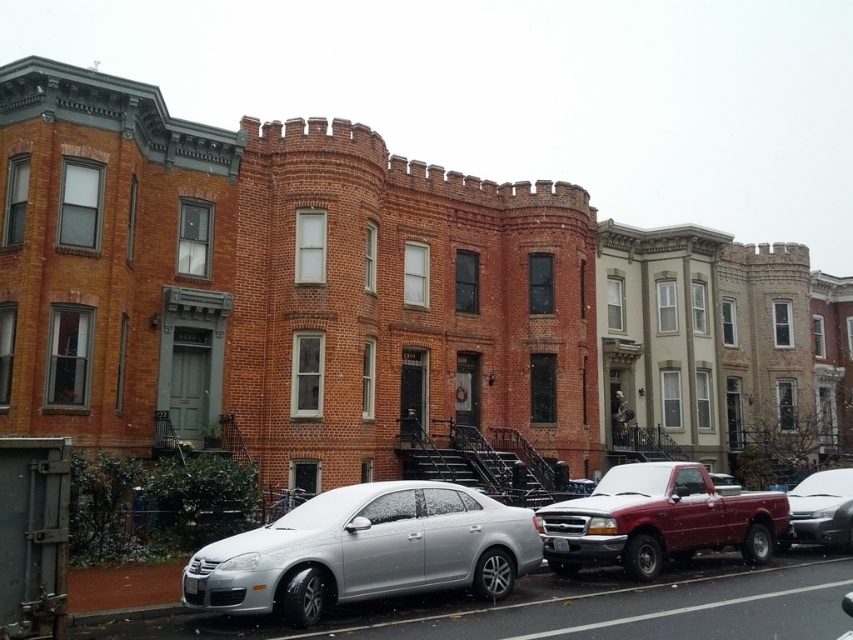
Consider the image. Does satin silver sedan at lower left appear under silver metallic sedan at center?

Incorrect, satin silver sedan at lower left is not positioned below silver metallic sedan at center.

In the scene shown: Is satin silver sedan at lower left positioned at the back of silver metallic sedan at center?

That is False.

Who is more distant from viewer, [363,544] or [834,481]?

The point [834,481] is more distant.

Identify the location of satin silver sedan at lower left. The height and width of the screenshot is (640, 853). (366, 550).

Does shiny red pickup truck at center have a greater width compared to silver metallic sedan at center?

Indeed, shiny red pickup truck at center has a greater width compared to silver metallic sedan at center.

Between shiny red pickup truck at center and silver metallic sedan at center, which one has more height?

Standing taller between the two is shiny red pickup truck at center.

Which is behind, point (636, 480) or point (790, 499)?

Positioned behind is point (790, 499).

Image resolution: width=853 pixels, height=640 pixels. Identify the location of shiny red pickup truck at center. (659, 520).

Does satin silver sedan at lower left have a greater width compared to shiny red pickup truck at center?

No, satin silver sedan at lower left is not wider than shiny red pickup truck at center.

Can you confirm if satin silver sedan at lower left is bigger than shiny red pickup truck at center?

Actually, satin silver sedan at lower left might be smaller than shiny red pickup truck at center.

Does point (424, 522) lie in front of point (648, 488)?

That is True.

Find the location of `satin silver sedan at lower left`. satin silver sedan at lower left is located at coordinates (366, 550).